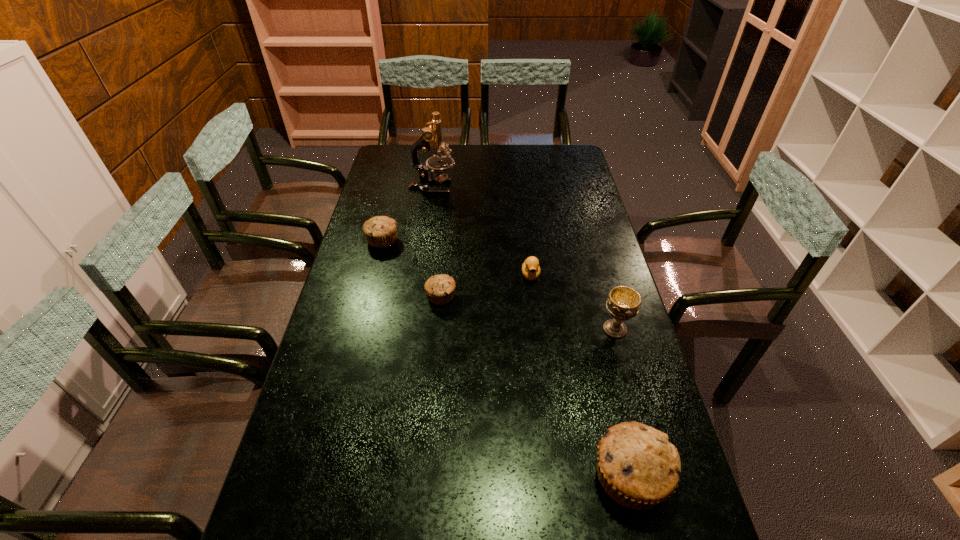
This screenshot has height=540, width=960. I want to click on the third object from right to left, so click(531, 270).

Locate an element on the screen. vacant space located on the front of the farthest muffin is located at coordinates (376, 265).

Locate an element on the screen. vacant space located 0.170m on the right of the second muffin from right to left is located at coordinates (510, 296).

Find the location of `free space located on the left of the nearest object`. free space located on the left of the nearest object is located at coordinates (547, 477).

At what (x,y) coordinates should I click in order to perform the action: click on vacant position located on the front of the chalice. Please return your answer as a coordinate pair (x, y). Looking at the image, I should click on (653, 461).

You are a GUI agent. You are given a task and a screenshot of the screen. Output one action in this format:
    pyautogui.click(x=<x>, y=<y>)
    Task: Click on the free location located at the eyepiece of the farthest object
    The image size is (960, 540).
    Given the screenshot: What is the action you would take?
    pyautogui.click(x=539, y=187)

This screenshot has width=960, height=540. I want to click on free spot located 0.110m facing forward on the duckling, so click(x=535, y=309).

This screenshot has height=540, width=960. I want to click on object at the near edge, so click(x=638, y=467).

Where is `muffin that is at the left edge`? The image size is (960, 540). muffin that is at the left edge is located at coordinates (380, 231).

Locate an element on the screen. The width and height of the screenshot is (960, 540). microscope that is positioned at the left edge is located at coordinates pyautogui.click(x=431, y=138).